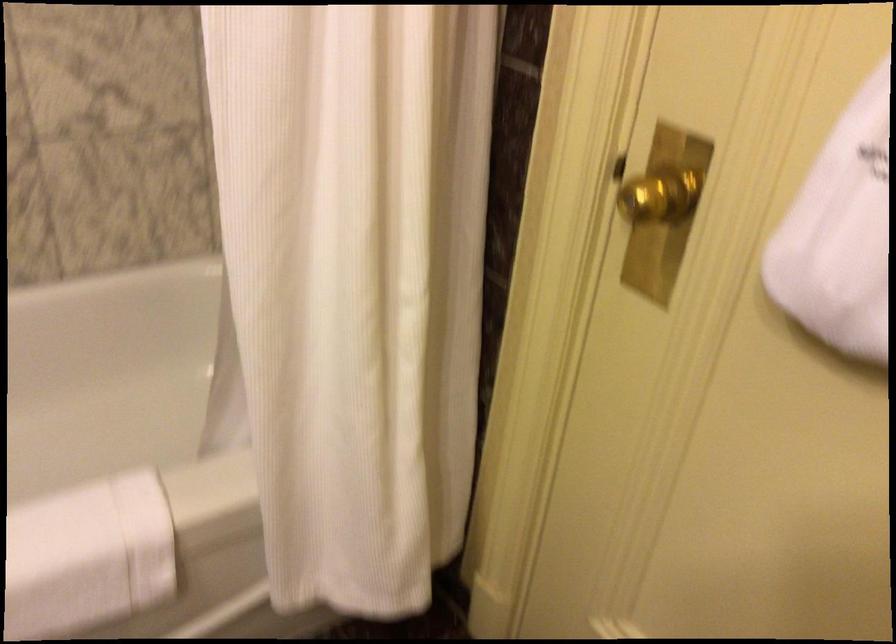
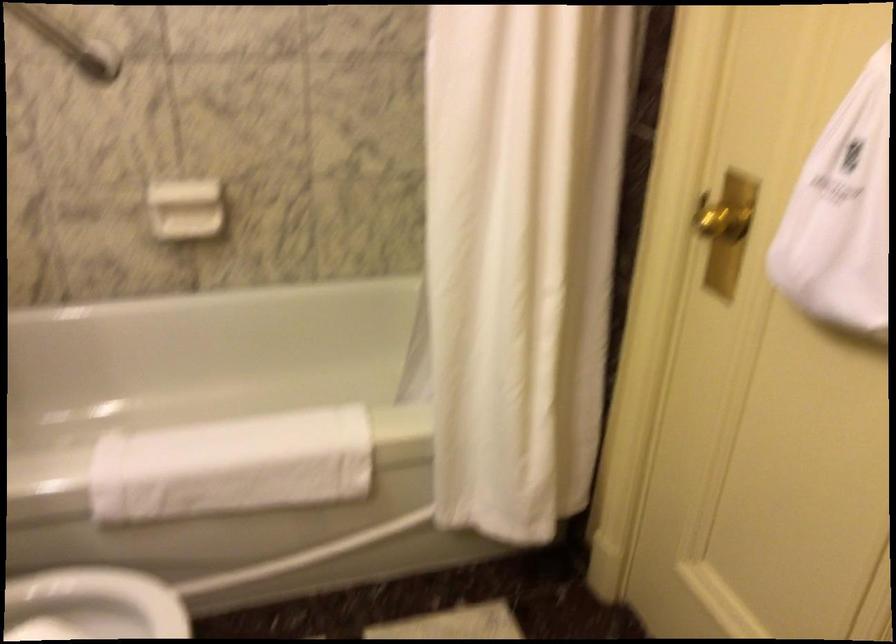
Where in the second image is the point corresponding to [653,211] from the first image?

(722, 222)